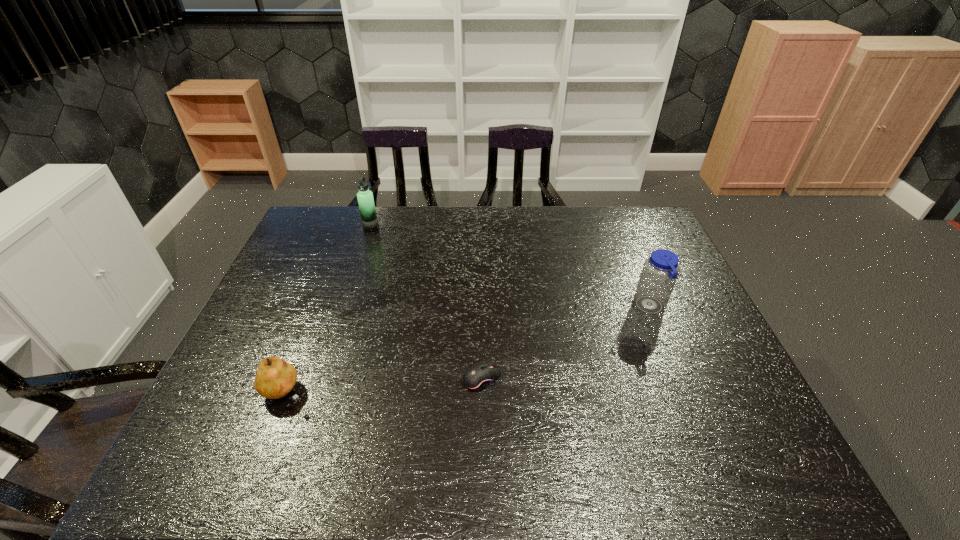
Locate an element on the screen. thermos bottle is located at coordinates (365, 198).

You are a GUI agent. You are given a task and a screenshot of the screen. Output one action in this format:
    pyautogui.click(x=<x>, y=<y>)
    Task: Click on the rightmost object
    
    Given the screenshot: What is the action you would take?
    pyautogui.click(x=660, y=271)

Identify the location of water bottle. The height and width of the screenshot is (540, 960). (660, 271).

Where is `pear`? pear is located at coordinates (275, 378).

This screenshot has width=960, height=540. I want to click on computer mouse, so click(478, 377).

The image size is (960, 540). I want to click on the shortest object, so click(478, 377).

Identify the location of free space located on the front of the farthest object. (355, 274).

The width and height of the screenshot is (960, 540). Find the location of `free location located with a carrying loop on the side of the water bottle`. free location located with a carrying loop on the side of the water bottle is located at coordinates (505, 307).

You are a GUI agent. You are given a task and a screenshot of the screen. Output one action in this format:
    pyautogui.click(x=<x>, y=<y>)
    Task: Click on the free space located 0.260m with a carrying loop on the side of the water bottle
    
    Given the screenshot: What is the action you would take?
    pyautogui.click(x=543, y=307)

You are a GUI agent. You are given a task and a screenshot of the screen. Output one action in this format:
    pyautogui.click(x=<x>, y=<y>)
    Task: Click on the blank area located 0.150m with a carrying loop on the side of the water bottle
    Image resolution: width=960 pixels, height=540 pixels.
    Given the screenshot: What is the action you would take?
    pyautogui.click(x=582, y=307)